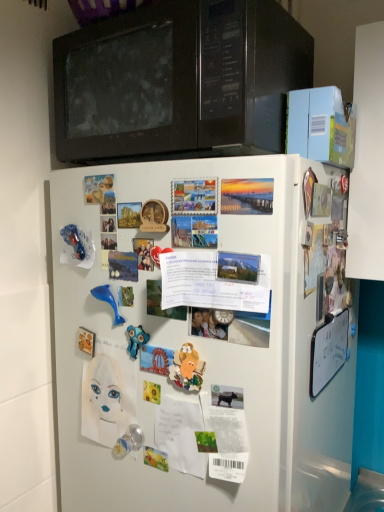
What is the approximate height of blue rubber dolphin at center-left, arranged as the 1th toy when viewed from the left?

It is 3.46 inches.

Find the location of `blue rubber toy at center, the second toy when ordered from right to left`. blue rubber toy at center, the second toy when ordered from right to left is located at coordinates (136, 339).

Image resolution: width=384 pixels, height=512 pixels. In order to click on black matte microwave at upper center in this screenshot , I will do `click(179, 80)`.

Locate an element on the screen. This screenshot has height=512, width=384. transparent plastic toy at lower center, the third toy viewed from the right is located at coordinates (129, 441).

How much space does matte paper poster at upper left, which ranks as the first poster in left-to-right order, occupy vertically?

It is 2.34 inches.

Image resolution: width=384 pixels, height=512 pixels. Describe the element at coordinates (211, 283) in the screenshot. I see `white paper at center, positioned as the 1th poster in right-to-left order` at that location.

Locate an element on the screen. This screenshot has height=512, width=384. blue rubber dolphin at center-left, which is the 1th toy in top-to-bottom order is located at coordinates (107, 301).

Are blue rubber dolphin at center-left, placed as the 4th toy when sorted from bottom to top, and white paper at center, which ranks as the first poster in front-to-back order, located far from each other?

blue rubber dolphin at center-left, placed as the 4th toy when sorted from bottom to top, is near white paper at center, which ranks as the first poster in front-to-back order, not far away.

Which is correct: blue rubber dolphin at center-left, which is the fourth toy in right-to-left order, is inside white paper at center, positioned as the 1th poster in right-to-left order, or outside of it?

blue rubber dolphin at center-left, which is the fourth toy in right-to-left order, is outside white paper at center, positioned as the 1th poster in right-to-left order.

Can you confirm if blue rubber dolphin at center-left, placed as the 4th toy when sorted from bottom to top, is thinner than white paper at center, which ranks as the first poster in front-to-back order?

Correct, the width of blue rubber dolphin at center-left, placed as the 4th toy when sorted from bottom to top, is less than that of white paper at center, which ranks as the first poster in front-to-back order.

Which object is positioned more to the left, blue rubber dolphin at center-left, which is the fourth toy in right-to-left order, or white paper at center, marked as the 1th poster in a bottom-to-top arrangement?

Positioned to the left is blue rubber dolphin at center-left, which is the fourth toy in right-to-left order.

Measure the distance between white paper at center, marked as the 1th poster in a bottom-to-top arrangement, and transparent plastic toy at lower center, which is counted as the 4th toy, starting from the top.

white paper at center, marked as the 1th poster in a bottom-to-top arrangement, and transparent plastic toy at lower center, which is counted as the 4th toy, starting from the top, are 34.91 centimeters apart from each other.

Which object is further away from the camera taking this photo, white paper at center, placed as the second poster when sorted from back to front, or transparent plastic toy at lower center, the third toy viewed from the right?

transparent plastic toy at lower center, the third toy viewed from the right, is behind.

Is white paper at center, placed as the second poster when sorted from back to front, oriented away from transparent plastic toy at lower center, placed as the first toy when sorted from bottom to top?

No, transparent plastic toy at lower center, placed as the first toy when sorted from bottom to top, is not at the back of white paper at center, placed as the second poster when sorted from back to front.

Can you confirm if matte plastic toy at center, which is the third toy from top to bottom, is thinner than blue rubber toy at center, acting as the 2th toy starting from the top?

In fact, matte plastic toy at center, which is the third toy from top to bottom, might be wider than blue rubber toy at center, acting as the 2th toy starting from the top.

Between matte plastic toy at center, which is the third toy from top to bottom, and blue rubber toy at center, which appears as the 3th toy when ordered from the bottom, which one is positioned behind?

blue rubber toy at center, which appears as the 3th toy when ordered from the bottom, is further from the camera.

Would you say matte plastic toy at center, which is the third toy from top to bottom, is inside or outside blue rubber toy at center, which appears as the 3th toy when ordered from the bottom?

matte plastic toy at center, which is the third toy from top to bottom, is spatially situated outside blue rubber toy at center, which appears as the 3th toy when ordered from the bottom.

Is matte plastic toy at center, positioned as the second toy in bottom-to-top order, facing towards blue rubber toy at center, which is counted as the 3th toy, starting from the left?

No, matte plastic toy at center, positioned as the second toy in bottom-to-top order, does not turn towards blue rubber toy at center, which is counted as the 3th toy, starting from the left.

Is matte paper poster at upper left, positioned as the 2th poster in front-to-back order, surrounded by matte plastic toy at center, the fourth toy in the left-to-right sequence?

No.

In the image, is matte plastic toy at center, which is the third toy from top to bottom, positioned in front of or behind matte paper poster at upper left, which appears as the 2th poster when ordered from the bottom?

Visually, matte plastic toy at center, which is the third toy from top to bottom, is located in front of matte paper poster at upper left, which appears as the 2th poster when ordered from the bottom.

From the image's perspective, starting from the matte plastic toy at center, positioned as the second toy in bottom-to-top order, which poster is the 2nd one above? Please provide its 2D coordinates.

[(99, 189)]

Could you tell me if matte plastic toy at center, which is the third toy from top to bottom, is facing matte paper poster at upper left, positioned as the 2th poster in front-to-back order?

No, matte plastic toy at center, which is the third toy from top to bottom, is not turned towards matte paper poster at upper left, positioned as the 2th poster in front-to-back order.

Locate an element on the screen. the 2nd toy to the right when counting from the blue rubber dolphin at center-left, which is the fourth toy in right-to-left order is located at coordinates (136, 339).

From the image's perspective, is blue rubber toy at center, which is counted as the 3th toy, starting from the left, on top of blue rubber dolphin at center-left, which is the fourth toy in right-to-left order?

No, from the image's perspective, blue rubber toy at center, which is counted as the 3th toy, starting from the left, is not over blue rubber dolphin at center-left, which is the fourth toy in right-to-left order.

Is blue rubber toy at center, the second toy when ordered from right to left, situated inside blue rubber dolphin at center-left, placed as the 4th toy when sorted from bottom to top, or outside?

blue rubber toy at center, the second toy when ordered from right to left, is spatially situated outside blue rubber dolphin at center-left, placed as the 4th toy when sorted from bottom to top.

Which of these two, blue rubber toy at center, which appears as the 3th toy when ordered from the bottom, or blue rubber dolphin at center-left, which is the fourth toy in right-to-left order, is bigger?

blue rubber dolphin at center-left, which is the fourth toy in right-to-left order, is bigger.

How much distance is there between blue rubber toy at center, the second toy when ordered from right to left, and white paper at center, which ranks as the first poster in front-to-back order?

They are 17.89 centimeters apart.

How many degrees apart are the facing directions of blue rubber toy at center, which is counted as the 3th toy, starting from the left, and white paper at center, placed as the second poster when sorted from back to front?

The angular difference between blue rubber toy at center, which is counted as the 3th toy, starting from the left, and white paper at center, placed as the second poster when sorted from back to front, is 6.58 degrees.

Is the position of blue rubber toy at center, acting as the 2th toy starting from the top, more distant than that of white paper at center, placed as the second poster when sorted from back to front?

Yes, it is.

Between point (145, 337) and point (251, 291), which one is positioned in front?

The point (251, 291) is more forward.

Which is in front, point (107, 301) or point (153, 36)?

The point (153, 36) is in front.

Is blue rubber dolphin at center-left, arranged as the 1th toy when viewed from the left, in front of or behind black matte microwave at upper center in the image?

blue rubber dolphin at center-left, arranged as the 1th toy when viewed from the left, is behind black matte microwave at upper center.

Who is bigger, blue rubber dolphin at center-left, which is the fourth toy in right-to-left order, or black matte microwave at upper center?

black matte microwave at upper center is bigger.

From a real-world perspective, between blue rubber dolphin at center-left, which is the 1th toy in top-to-bottom order, and black matte microwave at upper center, who is vertically lower?

From a 3D spatial view, blue rubber dolphin at center-left, which is the 1th toy in top-to-bottom order, is below.

Image resolution: width=384 pixels, height=512 pixels. I want to click on poster on the right side of blue rubber dolphin at center-left, which is the 1th toy in top-to-bottom order, so click(211, 283).

The image size is (384, 512). I want to click on the 4th toy positioned below the white paper at center, positioned as the 1th poster in right-to-left order (from a real-world perspective), so click(129, 441).

Consider the image. From the image, which object appears to be farther from white matte refrigerator at center, white paper at center, arranged as the 2th poster when viewed from the left, or matte paper poster at upper left, which is the 1th poster from back to front?

The object further to white matte refrigerator at center is matte paper poster at upper left, which is the 1th poster from back to front.

When comparing their distances from blue rubber toy at center, acting as the 2th toy starting from the top, does blue rubber dolphin at center-left, arranged as the 1th toy when viewed from the left, or white paper at center, placed as the second poster when sorted from back to front, seem closer?

The object closer to blue rubber toy at center, acting as the 2th toy starting from the top, is blue rubber dolphin at center-left, arranged as the 1th toy when viewed from the left.

Looking at the image, which one is located closer to blue rubber dolphin at center-left, which is the fourth toy in right-to-left order, white paper at center, marked as the 1th poster in a bottom-to-top arrangement, or white matte refrigerator at center?

white paper at center, marked as the 1th poster in a bottom-to-top arrangement, is positioned closer to the anchor blue rubber dolphin at center-left, which is the fourth toy in right-to-left order.

Based on the photo, from the image, which object appears to be nearer to white matte refrigerator at center, black matte microwave at upper center or blue rubber dolphin at center-left, which is the fourth toy in right-to-left order?

Based on the image, blue rubber dolphin at center-left, which is the fourth toy in right-to-left order, appears to be nearer to white matte refrigerator at center.

Estimate the real-world distances between objects in this image. Which object is further from transparent plastic toy at lower center, placed as the first toy when sorted from bottom to top, blue rubber toy at center, which is counted as the 3th toy, starting from the left, or black matte microwave at upper center?

black matte microwave at upper center is positioned further to the anchor transparent plastic toy at lower center, placed as the first toy when sorted from bottom to top.

Considering their positions, is white paper at center, marked as the 1th poster in a bottom-to-top arrangement, positioned further to black matte microwave at upper center than matte paper poster at upper left, which ranks as the first poster in left-to-right order?

white paper at center, marked as the 1th poster in a bottom-to-top arrangement, lies further to black matte microwave at upper center than the other object.

Considering their positions, is white paper at center, which ranks as the first poster in front-to-back order, positioned closer to white matte refrigerator at center than matte plastic toy at center, positioned as the second toy in bottom-to-top order?

Based on the image, white paper at center, which ranks as the first poster in front-to-back order, appears to be nearer to white matte refrigerator at center.

From the image, which object appears to be nearer to transparent plastic toy at lower center, the third toy viewed from the right, matte plastic toy at center, the 1th toy from the right, or white matte refrigerator at center?

The object closer to transparent plastic toy at lower center, the third toy viewed from the right, is matte plastic toy at center, the 1th toy from the right.

I want to click on poster between matte paper poster at upper left, acting as the second poster starting from the right, and transparent plastic toy at lower center, the third toy viewed from the right, in the vertical direction, so click(x=211, y=283).

The height and width of the screenshot is (512, 384). I want to click on toy between black matte microwave at upper center and blue rubber toy at center, which appears as the 3th toy when ordered from the bottom, vertically, so click(x=107, y=301).

Image resolution: width=384 pixels, height=512 pixels. I want to click on poster between matte paper poster at upper left, which ranks as the first poster in left-to-right order, and white matte refrigerator at center in the up-down direction, so click(211, 283).

Where is `poster between matte paper poster at upper left, acting as the second poster starting from the right, and blue rubber toy at center, which is counted as the 3th toy, starting from the left, in the up-down direction`? This screenshot has width=384, height=512. poster between matte paper poster at upper left, acting as the second poster starting from the right, and blue rubber toy at center, which is counted as the 3th toy, starting from the left, in the up-down direction is located at coordinates (211, 283).